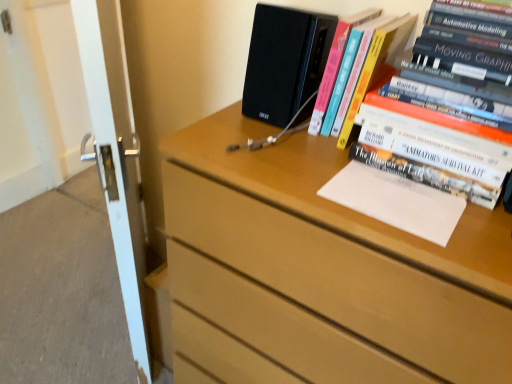
Find the location of a particular element. The width and height of the screenshot is (512, 384). free location to the left of hardcover book at upper right, which appears as the second book when viewed from the right is located at coordinates (262, 134).